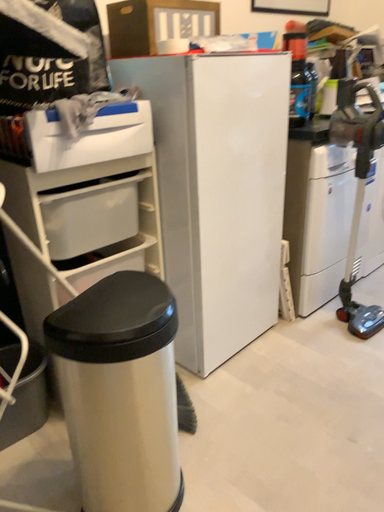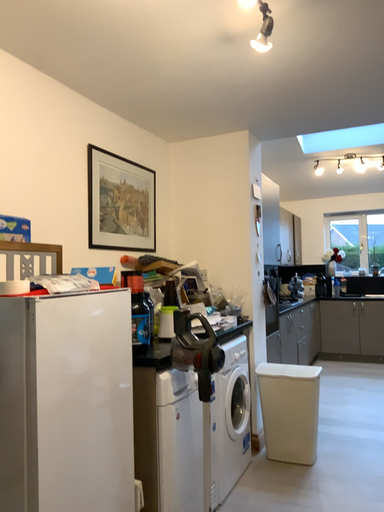
Question: Which way did the camera rotate in the video?

Choices:
 (A) rotated downward
 (B) rotated upward

Answer: (B)